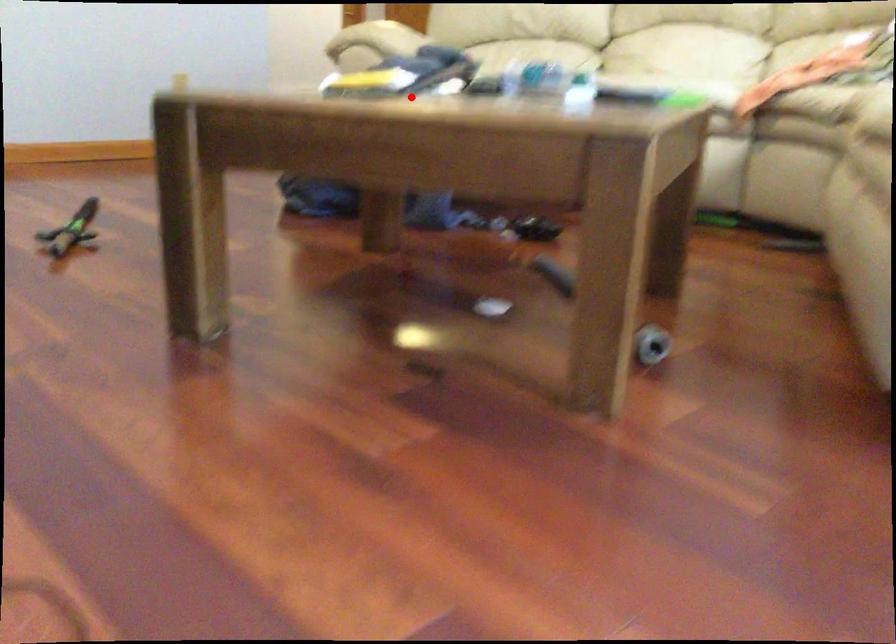
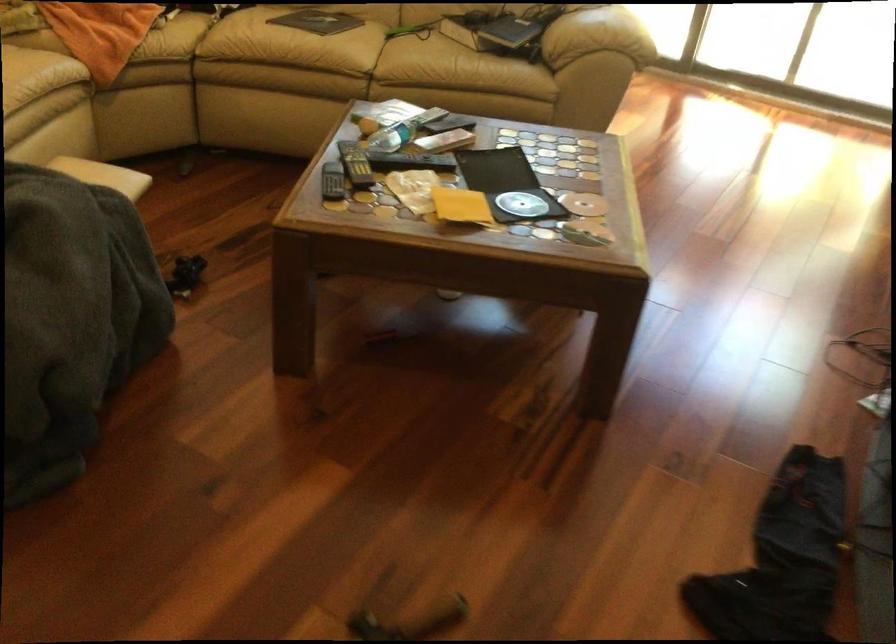
Find the pixel in the second image that matches the highlighted location in the first image.

(506, 184)